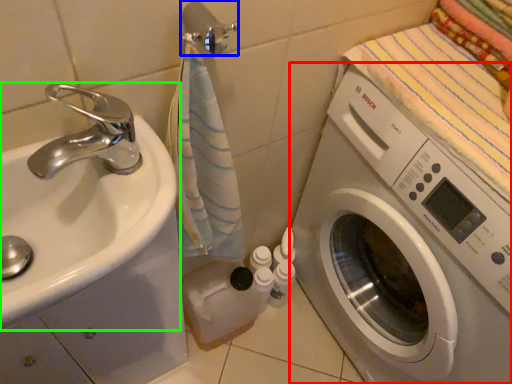
Question: Which object is positioned closest to washing machine (highlighted by a red box)? Select from towel bar (highlighted by a blue box) and sink (highlighted by a green box).

Choices:
 (A) towel bar
 (B) sink

Answer: (B)